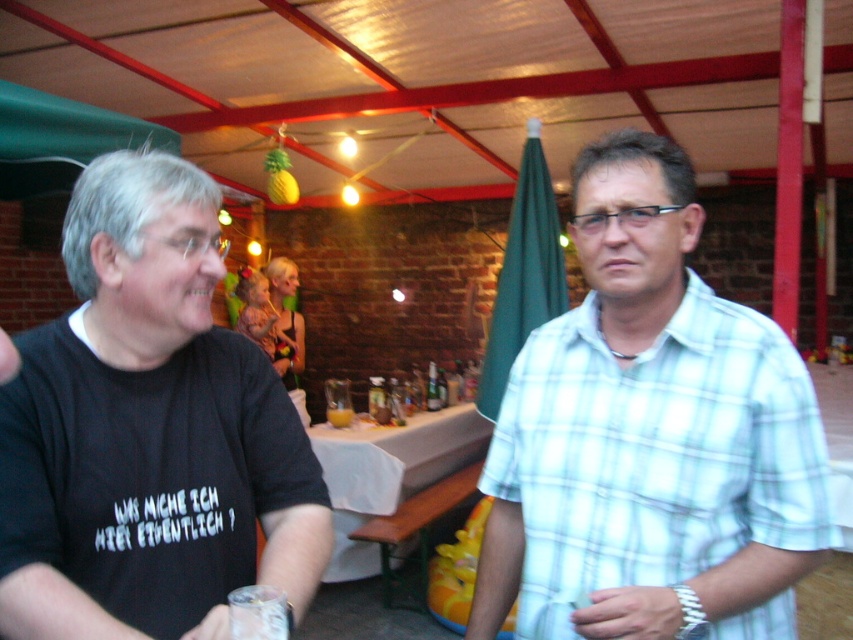
Which is behind, point (590, 348) or point (294, 346)?

Point (294, 346)

Which of these two, light blue plaid shirt at center or blonde hair baby at center, stands taller?

blonde hair baby at center is taller.

This screenshot has width=853, height=640. What are the coordinates of `light blue plaid shirt at center` in the screenshot? It's located at (650, 436).

You are a GUI agent. You are given a task and a screenshot of the screen. Output one action in this format:
    pyautogui.click(x=<x>, y=<y>)
    Task: Click on the light blue plaid shirt at center
    The image size is (853, 640).
    Given the screenshot: What is the action you would take?
    pyautogui.click(x=650, y=436)

Can you confirm if light blue plaid shirt at center is positioned above white fabric-covered table at center?

Indeed, light blue plaid shirt at center is positioned over white fabric-covered table at center.

Which is behind, point (660, 205) or point (392, 477)?

The point (392, 477) is behind.

Locate an element on the screen. Image resolution: width=853 pixels, height=640 pixels. light blue plaid shirt at center is located at coordinates (650, 436).

Does black t-shirt at left have a lesser width compared to white fabric-covered table at center?

Correct, black t-shirt at left's width is less than white fabric-covered table at center's.

Does black t-shirt at left have a lesser height compared to white fabric-covered table at center?

Yes, black t-shirt at left is shorter than white fabric-covered table at center.

This screenshot has width=853, height=640. What do you see at coordinates (148, 429) in the screenshot? I see `black t-shirt at left` at bounding box center [148, 429].

The width and height of the screenshot is (853, 640). I want to click on black t-shirt at left, so click(x=148, y=429).